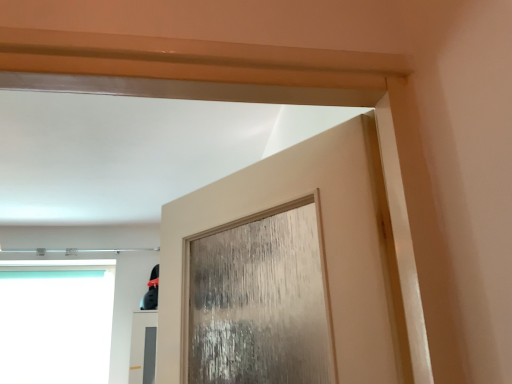
Locate an element on the screen. Image resolution: width=512 pixels, height=384 pixels. white glass window at upper left is located at coordinates (56, 324).

What is the approximate width of white glass window at upper left?

It is 3.97 inches.

What do you see at coordinates (56, 324) in the screenshot?
I see `white glass window at upper left` at bounding box center [56, 324].

Locate an element on the screen. white glass window at upper left is located at coordinates (56, 324).